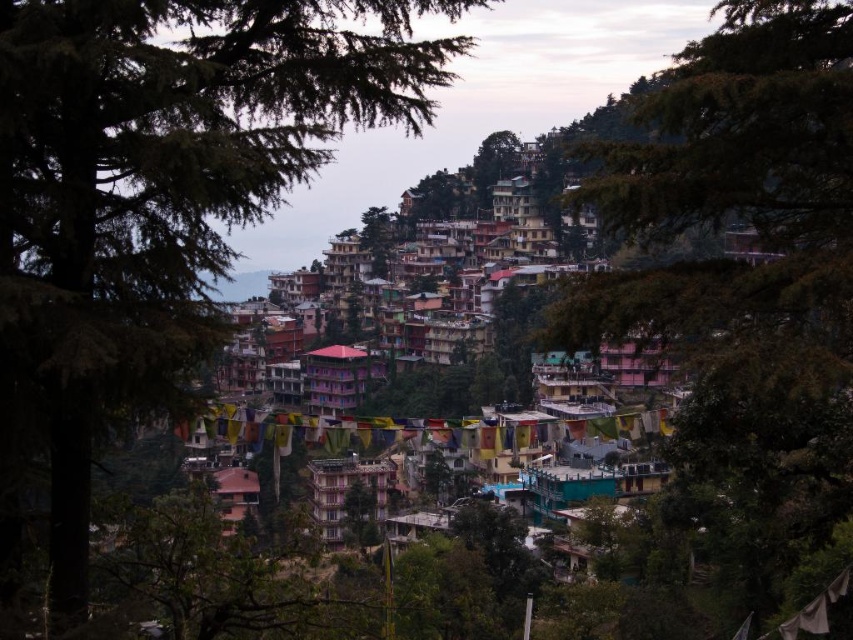
Who is higher up, green textured tree at upper left or green leafy tree at center?

green textured tree at upper left is above.

Where is `green textured tree at upper left`? green textured tree at upper left is located at coordinates (155, 200).